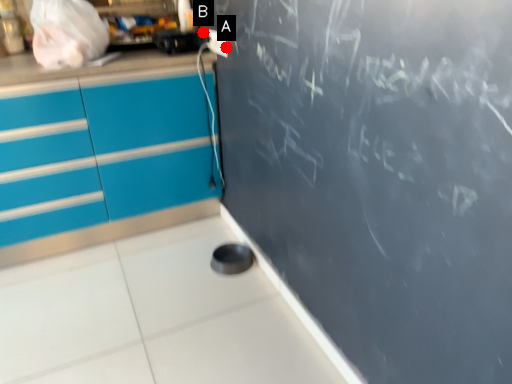
Question: Two points are circled on the image, labeled by A and B beside each circle. Which point appears farthest from the camera in this image?

Choices:
 (A) A is further
 (B) B is further

Answer: (B)